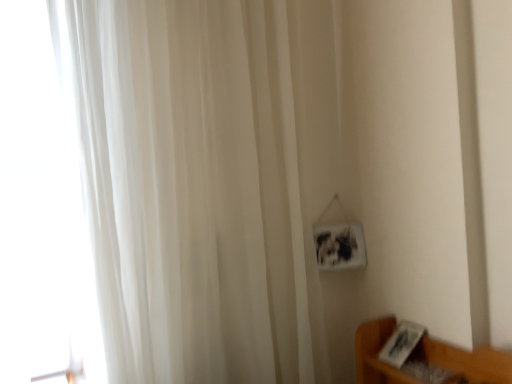
Question: Is transparent glass door at left aimed at white sheer curtain at left?

Choices:
 (A) yes
 (B) no

Answer: (A)

Question: Can you confirm if transparent glass door at left is shorter than white sheer curtain at left?

Choices:
 (A) yes
 (B) no

Answer: (A)

Question: Does transparent glass door at left lie in front of white sheer curtain at left?

Choices:
 (A) no
 (B) yes

Answer: (A)

Question: Is transparent glass door at left not inside white sheer curtain at left?

Choices:
 (A) yes
 (B) no

Answer: (A)

Question: Is transparent glass door at left smaller than white sheer curtain at left?

Choices:
 (A) yes
 (B) no

Answer: (A)

Question: Does transparent glass door at left come behind white sheer curtain at left?

Choices:
 (A) yes
 (B) no

Answer: (A)

Question: Could transparent glass door at left be considered to be inside white sheer curtain at left?

Choices:
 (A) yes
 (B) no

Answer: (B)

Question: Does white sheer curtain at left have a greater width compared to transparent glass door at left?

Choices:
 (A) yes
 (B) no

Answer: (A)

Question: From a real-world perspective, is white sheer curtain at left positioned over transparent glass door at left based on gravity?

Choices:
 (A) yes
 (B) no

Answer: (B)

Question: Considering the relative sizes of white sheer curtain at left and transparent glass door at left in the image provided, is white sheer curtain at left smaller than transparent glass door at left?

Choices:
 (A) yes
 (B) no

Answer: (B)

Question: From a real-world perspective, is white sheer curtain at left under transparent glass door at left?

Choices:
 (A) no
 (B) yes

Answer: (B)

Question: Is white sheer curtain at left looking in the opposite direction of transparent glass door at left?

Choices:
 (A) yes
 (B) no

Answer: (A)

Question: Looking at the image, does transparent glass door at left seem bigger or smaller compared to white sheer curtain at left?

Choices:
 (A) big
 (B) small

Answer: (B)